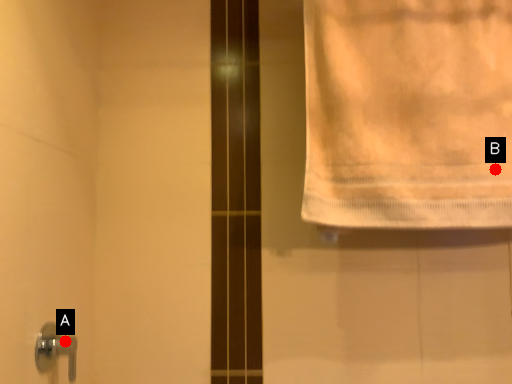
Question: Two points are circled on the image, labeled by A and B beside each circle. Which point is farther to the camera?

Choices:
 (A) A is further
 (B) B is further

Answer: (A)